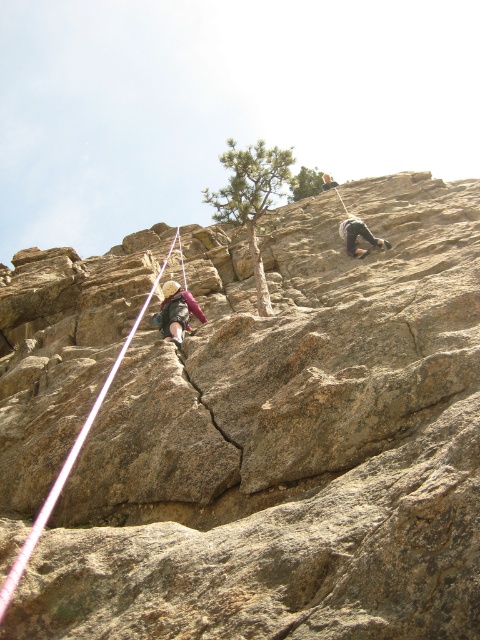
Based on the photo, you are a safety inspector checking the climbing setup. You notice the white nylon rope at left and the light brown leather helmet at upper center. According to safety protocols, the rope should be positioned above the climber for proper belay. Is the current setup compliant with safety standards?

The white nylon rope at left is below the light brown leather helmet at upper center, which means the rope is not positioned above the climber as required by safety protocols. This setup does not comply with safety standards.

Based on the photo, you are a safety inspector evaluating the climbing gear in the image. The white nylon rope at left and the light brown leather helmet at upper center are both critical for safety. Based on standard safety protocols, which item might require immediate attention due to its size being below the minimum requirement?

The white nylon rope at left might require immediate attention because it is thinner than the light brown leather helmet at upper center, and ropes must meet specific thickness standards for safety.

You are a photographer planning to take a closeup shot of the matte gray climbing harness at center and the dark gray rock climber at right. Based on their sizes in the image, which one should you focus on first to ensure they both fit in the frame?

The matte gray climbing harness at center is bigger than the dark gray rock climber at right, so you should focus on the matte gray climbing harness at center first to ensure both fit in the frame.